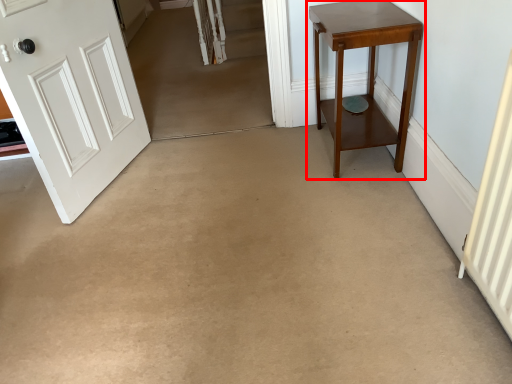
Question: In this image, where is table (annotated by the red box) located relative to door?

Choices:
 (A) right
 (B) left

Answer: (A)